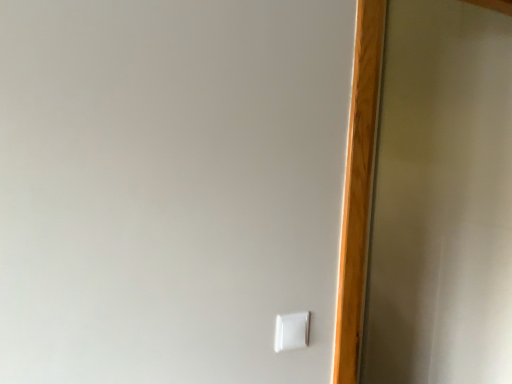
Question: Does transparent glass screen door at right have a greater width compared to white plastic light switch at lower right?

Choices:
 (A) yes
 (B) no

Answer: (A)

Question: Can you confirm if transparent glass screen door at right is thinner than white plastic light switch at lower right?

Choices:
 (A) no
 (B) yes

Answer: (A)

Question: Is transparent glass screen door at right oriented away from white plastic light switch at lower right?

Choices:
 (A) no
 (B) yes

Answer: (A)

Question: Considering the relative sizes of transparent glass screen door at right and white plastic light switch at lower right in the image provided, is transparent glass screen door at right taller than white plastic light switch at lower right?

Choices:
 (A) yes
 (B) no

Answer: (A)

Question: Would you say white plastic light switch at lower right is part of transparent glass screen door at right's contents?

Choices:
 (A) no
 (B) yes

Answer: (A)

Question: Is the depth of transparent glass screen door at right greater than that of white plastic light switch at lower right?

Choices:
 (A) no
 (B) yes

Answer: (B)

Question: Is white plastic light switch at lower right closer to the viewer compared to transparent glass screen door at right?

Choices:
 (A) yes
 (B) no

Answer: (A)

Question: Considering the relative positions of white plastic light switch at lower right and transparent glass screen door at right in the image provided, is white plastic light switch at lower right to the left of transparent glass screen door at right from the viewer's perspective?

Choices:
 (A) yes
 (B) no

Answer: (A)

Question: Can you confirm if white plastic light switch at lower right is positioned to the right of transparent glass screen door at right?

Choices:
 (A) no
 (B) yes

Answer: (A)

Question: Is white plastic light switch at lower right shorter than transparent glass screen door at right?

Choices:
 (A) no
 (B) yes

Answer: (B)

Question: Is white plastic light switch at lower right wider than transparent glass screen door at right?

Choices:
 (A) no
 (B) yes

Answer: (A)

Question: Is white plastic light switch at lower right thinner than transparent glass screen door at right?

Choices:
 (A) no
 (B) yes

Answer: (B)

Question: From the image's perspective, relative to transparent glass screen door at right, is white plastic light switch at lower right above or below?

Choices:
 (A) below
 (B) above

Answer: (A)